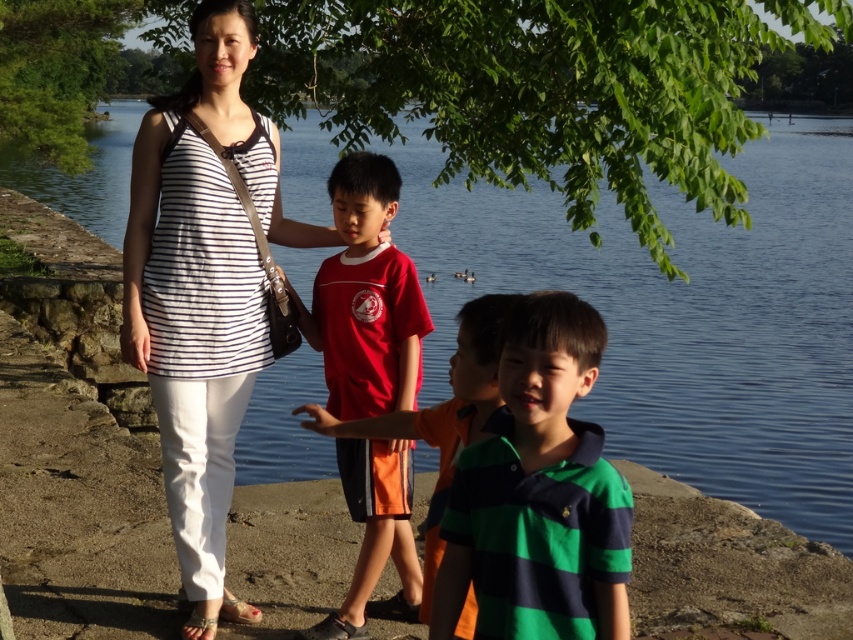
Question: Is green leafy tree at upper center smaller than white striped tank top at center?

Choices:
 (A) yes
 (B) no

Answer: (B)

Question: Which of the following is the closest to the observer?

Choices:
 (A) green striped polo shirt at center
 (B) blue water at center
 (C) red cotton shirt at center

Answer: (A)

Question: Does green leafy tree at upper center have a lesser width compared to green striped polo shirt at center?

Choices:
 (A) no
 (B) yes

Answer: (A)

Question: Which object is positioned closest to the green striped polo shirt at center?

Choices:
 (A) green leafy tree at upper center
 (B) blue water at center
 (C) red cotton shirt at center
 (D) orange fabric shirt at center

Answer: (D)

Question: Does green striped polo shirt at center have a larger size compared to orange fabric shirt at center?

Choices:
 (A) no
 (B) yes

Answer: (A)

Question: Among these points, which one is nearest to the camera?

Choices:
 (A) (148, 1)
 (B) (550, 458)

Answer: (B)